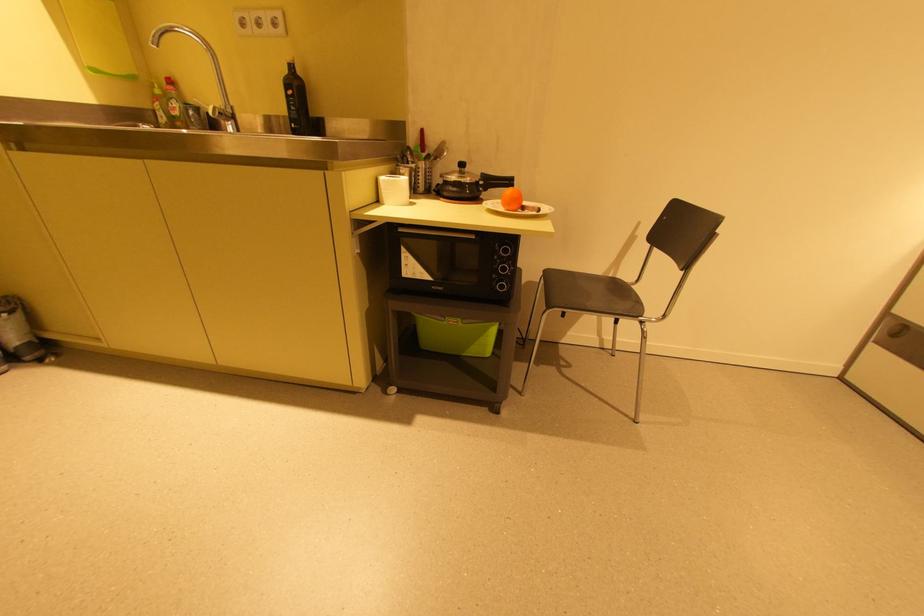
Where would you lift the silver faucet handle? Please return your answer as a coordinate pair (x, y).

(213, 113)